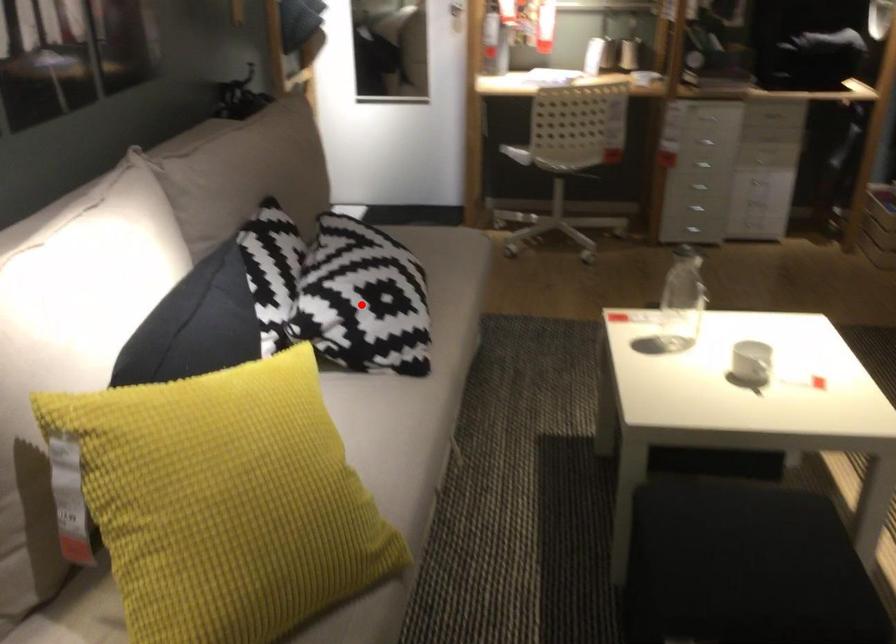
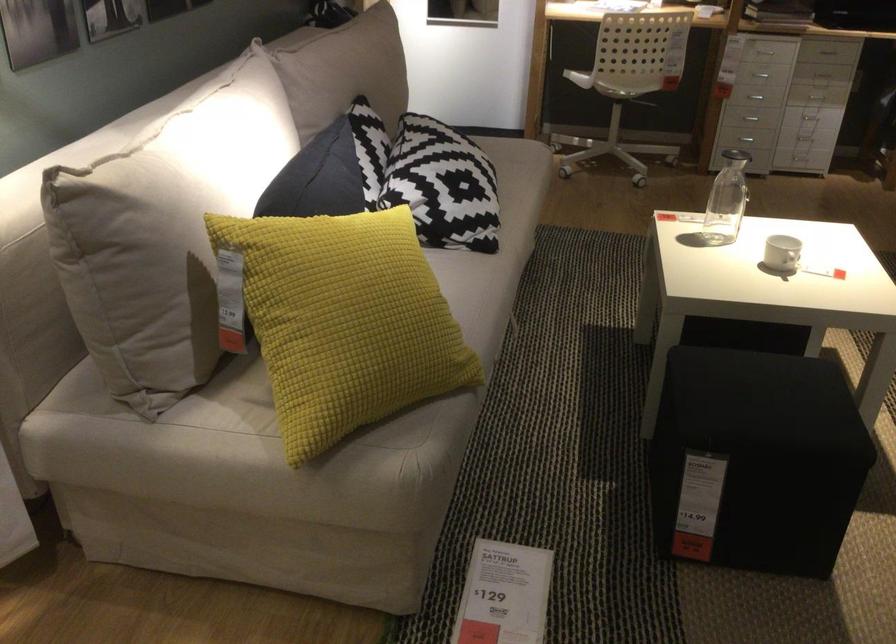
Question: A red point is marked in image1. In image2, is the corresponding 3D point closer to the camera or farther? Reply with the corresponding letter.

Choices:
 (A) The corresponding 3D point is closer.
 (B) The corresponding 3D point is farther.

Answer: (B)